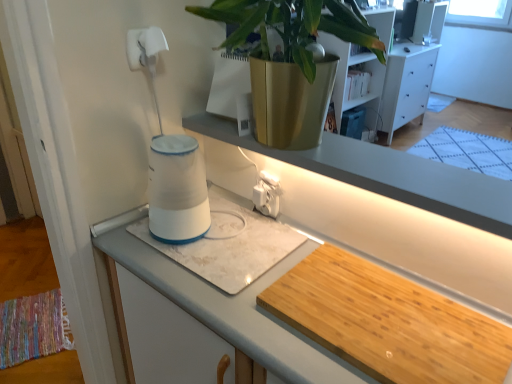
Where is `free location to the left of white plastic electric outlet at center`? free location to the left of white plastic electric outlet at center is located at coordinates (226, 218).